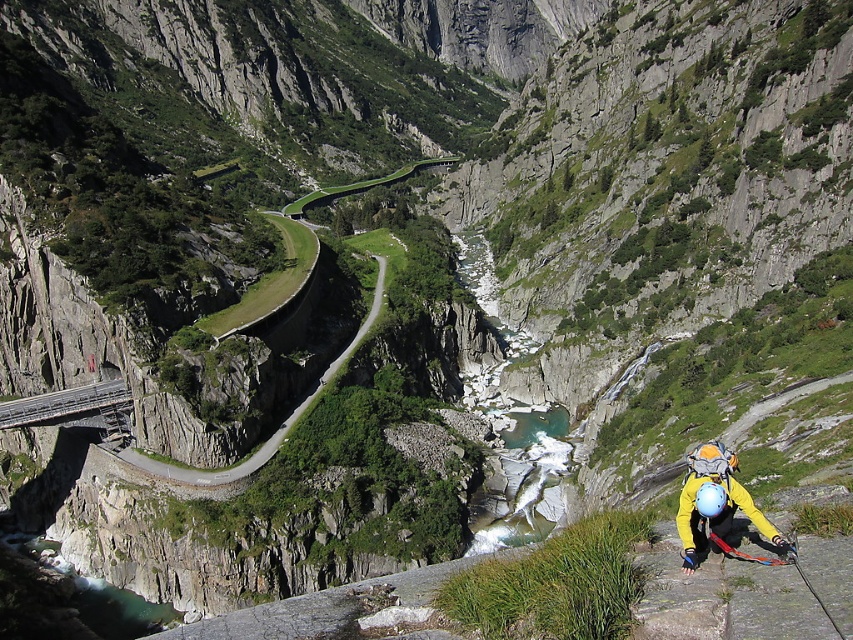
You are a hiker who wants to take a photo of the yellow fabric helmet at lower right and the metallic gray bridge at lower left. Which object should you zoom in on to capture more details in your photo?

The yellow fabric helmet at lower right is bigger than the metallic gray bridge at lower left, so you should zoom in on the yellow fabric helmet at lower right to capture more details.

You are a hiker planning to cross the valley. You have two options to choose from the image provided. The first is the green asphalt road at center, and the second is the metallic gray bridge at lower left. Based on their sizes, which path would you recommend for a larger vehicle like a truck?

The green asphalt road at center is bigger than the metallic gray bridge at lower left, so the green asphalt road at center would be more suitable for a larger vehicle like a truck.

You are a hiker standing at the base of the cliff looking up at the yellow fabric helmet at lower right and the green asphalt road at center. Which object is closer to you?

The yellow fabric helmet at lower right is closer to you because it is positioned under the green asphalt road at center, meaning it is lower in elevation and thus nearer to your vantage point at the base of the cliff.